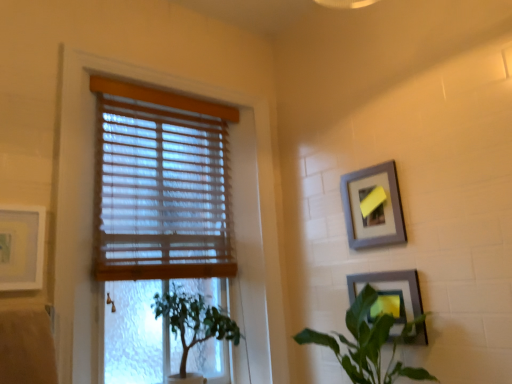
Question: Can you confirm if green leafy plant at lower right, which is the 1th houseplant from right to left, is smaller than green leafy plant at lower left, which ranks as the 2th houseplant in right-to-left order?

Choices:
 (A) no
 (B) yes

Answer: (A)

Question: Does green leafy plant at lower right, which is the 1th houseplant from right to left, lie behind green leafy plant at lower left, which ranks as the 2th houseplant in right-to-left order?

Choices:
 (A) no
 (B) yes

Answer: (A)

Question: From the image's perspective, would you say green leafy plant at lower right, positioned as the 2th houseplant in left-to-right order, is positioned over green leafy plant at lower left, which ranks as the 2th houseplant in right-to-left order?

Choices:
 (A) no
 (B) yes

Answer: (B)

Question: Considering the relative sizes of green leafy plant at lower right, positioned as the 2th houseplant in left-to-right order, and green leafy plant at lower left, which ranks as the 2th houseplant in right-to-left order, in the image provided, is green leafy plant at lower right, positioned as the 2th houseplant in left-to-right order, bigger than green leafy plant at lower left, which ranks as the 2th houseplant in right-to-left order,?

Choices:
 (A) yes
 (B) no

Answer: (A)

Question: Can you confirm if green leafy plant at lower right, which is the 1th houseplant from right to left, is shorter than green leafy plant at lower left, which ranks as the 2th houseplant in right-to-left order?

Choices:
 (A) no
 (B) yes

Answer: (B)

Question: Is green leafy plant at lower right, which is the 1th houseplant from right to left, thinner than green leafy plant at lower left, which ranks as the 2th houseplant in right-to-left order?

Choices:
 (A) no
 (B) yes

Answer: (B)

Question: Is gray matte picture frame at upper right, the second picture frame positioned from the right, not within green leafy plant at lower left, the first houseplant in the left-to-right sequence?

Choices:
 (A) yes
 (B) no

Answer: (A)

Question: Can you confirm if gray matte picture frame at upper right, the second picture frame positioned from the right, is bigger than green leafy plant at lower left, which ranks as the 2th houseplant in right-to-left order?

Choices:
 (A) yes
 (B) no

Answer: (B)

Question: Is the position of gray matte picture frame at upper right, the second picture frame when ordered from left to right, more distant than that of green leafy plant at lower left, the first houseplant in the left-to-right sequence?

Choices:
 (A) yes
 (B) no

Answer: (A)

Question: From a real-world perspective, is gray matte picture frame at upper right, the second picture frame when ordered from left to right, under green leafy plant at lower left, the first houseplant in the left-to-right sequence?

Choices:
 (A) yes
 (B) no

Answer: (B)

Question: Considering the relative sizes of gray matte picture frame at upper right, the second picture frame positioned from the right, and green leafy plant at lower left, which ranks as the 2th houseplant in right-to-left order, in the image provided, is gray matte picture frame at upper right, the second picture frame positioned from the right, wider than green leafy plant at lower left, which ranks as the 2th houseplant in right-to-left order,?

Choices:
 (A) no
 (B) yes

Answer: (A)

Question: Considering the relative sizes of gray matte picture frame at upper right, the second picture frame when ordered from left to right, and green leafy plant at lower left, which ranks as the 2th houseplant in right-to-left order, in the image provided, is gray matte picture frame at upper right, the second picture frame when ordered from left to right, taller than green leafy plant at lower left, which ranks as the 2th houseplant in right-to-left order,?

Choices:
 (A) no
 (B) yes

Answer: (A)

Question: Is wooden blinds at left further to camera compared to green leafy plant at lower right, positioned as the 2th houseplant in left-to-right order?

Choices:
 (A) yes
 (B) no

Answer: (A)